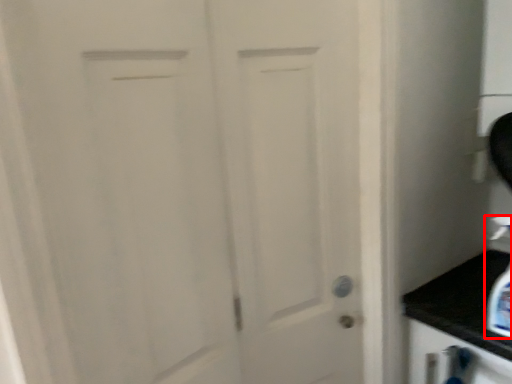
Question: Considering the relative positions of soap dispenser (annotated by the red box) and door in the image provided, where is soap dispenser (annotated by the red box) located with respect to the staircase?

Choices:
 (A) right
 (B) left

Answer: (A)